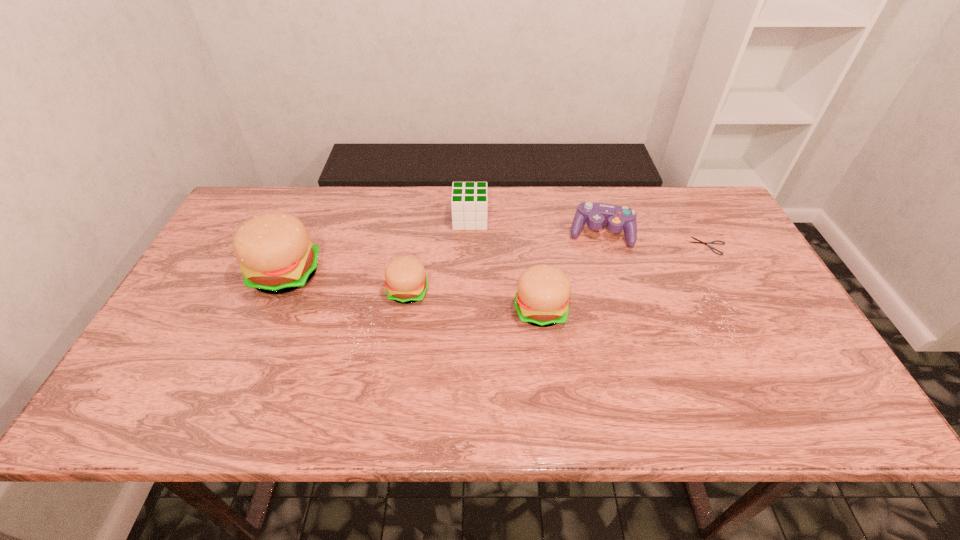
You are a GUI agent. You are given a task and a screenshot of the screen. Output one action in this format:
    pyautogui.click(x=<x>, y=<y>)
    Task: Click on the vacant point located between the fifth object from left to right and the second tallest hamburger
    This screenshot has width=960, height=540.
    Given the screenshot: What is the action you would take?
    pyautogui.click(x=570, y=272)

Locate an element on the screen. free space between the cube and the tallest object is located at coordinates (378, 247).

Where is `free area in between the control and the second object from left to right`? This screenshot has width=960, height=540. free area in between the control and the second object from left to right is located at coordinates (504, 262).

Locate an element on the screen. This screenshot has height=540, width=960. free area in between the fourth object from left to right and the control is located at coordinates (570, 272).

The width and height of the screenshot is (960, 540). Identify the location of vacant space that is in between the shortest object and the fifth object from left to right. (654, 239).

Locate which object is the closest to the second object from right to left. Please provide its 2D coordinates. Your answer should be formatted as a tuple, i.e. [(x, y)], where the tuple contains the x and y coordinates of a point satisfying the conditions above.

[(701, 242)]

Choose which object is the fifth nearest neighbor to the rightmost object. Please provide its 2D coordinates. Your answer should be formatted as a tuple, i.e. [(x, y)], where the tuple contains the x and y coordinates of a point satisfying the conditions above.

[(276, 255)]

At what (x,y) coordinates should I click in order to perform the action: click on hamburger that can be found as the second closest to the fourth object from right to left. Please return your answer as a coordinate pair (x, y). Looking at the image, I should click on (542, 299).

Where is `hamburger identified as the closest to the shortest hamburger`? The height and width of the screenshot is (540, 960). hamburger identified as the closest to the shortest hamburger is located at coordinates (276, 255).

Find the location of `vacant space that satisfies the following two spatial constraints: 1. on the red face of the control; 2. on the right side of the cube`. vacant space that satisfies the following two spatial constraints: 1. on the red face of the control; 2. on the right side of the cube is located at coordinates (469, 233).